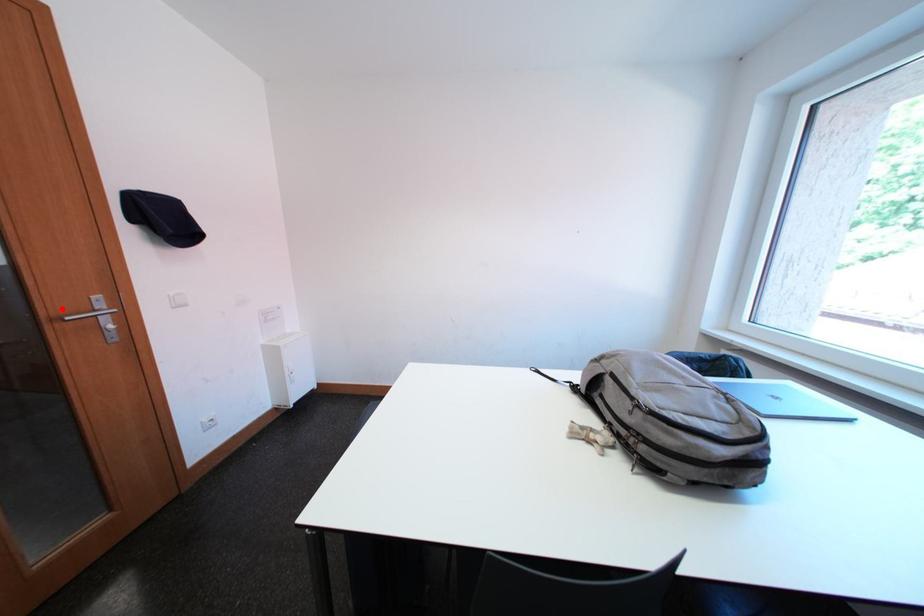
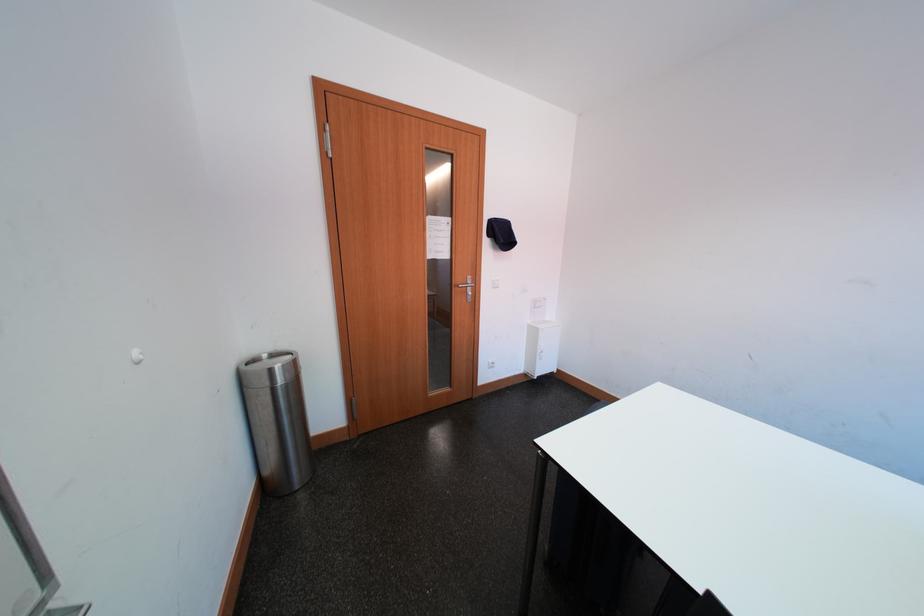
Locate, in the second image, the point that corresponds to the highlighted location in the first image.

(467, 283)